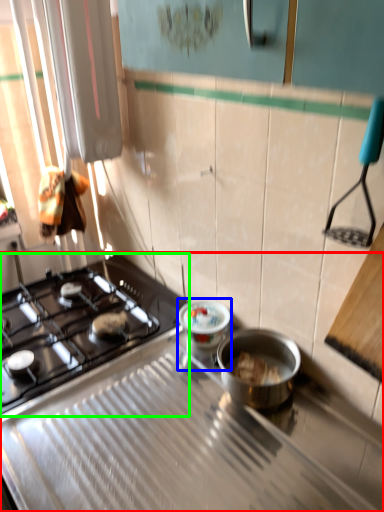
Question: Which object is the farthest from gas stove (highlighted by a red box)? Choose among these: appliance (highlighted by a blue box) or gas stove (highlighted by a green box).

Choices:
 (A) appliance
 (B) gas stove

Answer: (A)